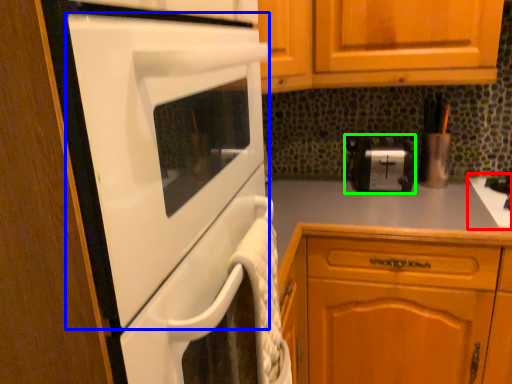
Question: Which object is positioned closest to gas stove (highlighted by a red box)? Select from home appliance (highlighted by a blue box) and toaster (highlighted by a green box).

Choices:
 (A) home appliance
 (B) toaster

Answer: (B)